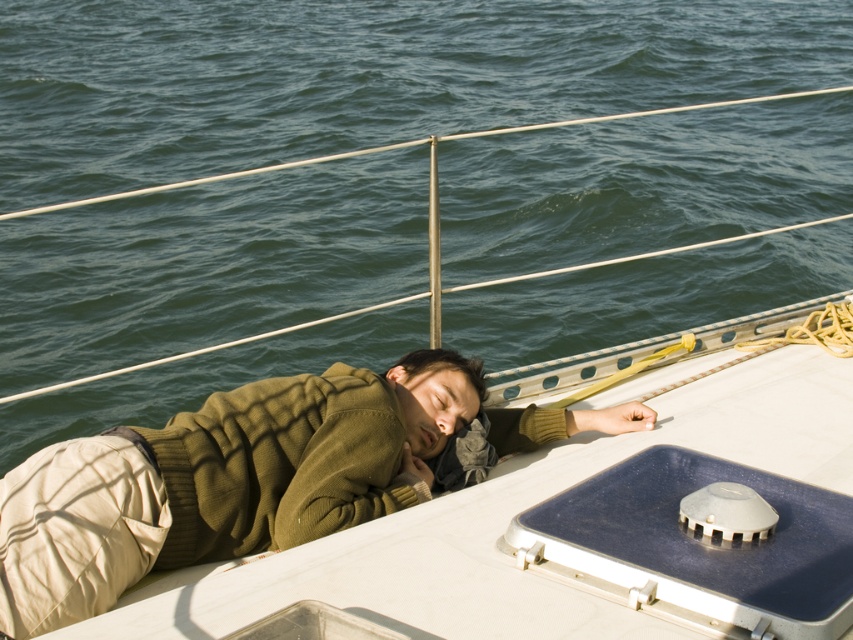
Who is positioned more to the left, green water at center or green knitted sweater at center?

green water at center is more to the left.

Is green water at center taller than green knitted sweater at center?

Indeed, green water at center has a greater height compared to green knitted sweater at center.

This screenshot has width=853, height=640. I want to click on green water at center, so click(x=360, y=76).